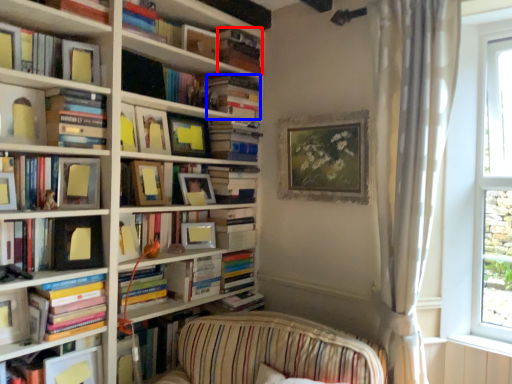
Question: Which object appears farthest to the camera in this image, book (highlighted by a red box) or book (highlighted by a blue box)?

Choices:
 (A) book
 (B) book

Answer: (B)